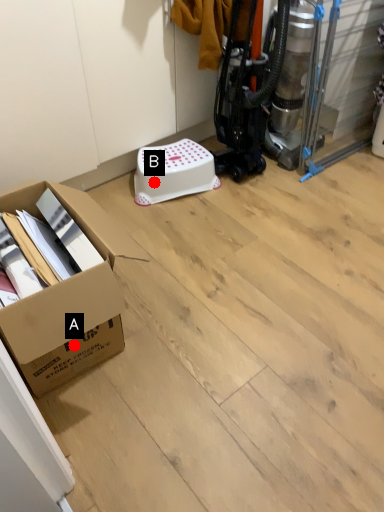
Question: Two points are circled on the image, labeled by A and B beside each circle. Which point is closer to the camera?

Choices:
 (A) A is closer
 (B) B is closer

Answer: (A)